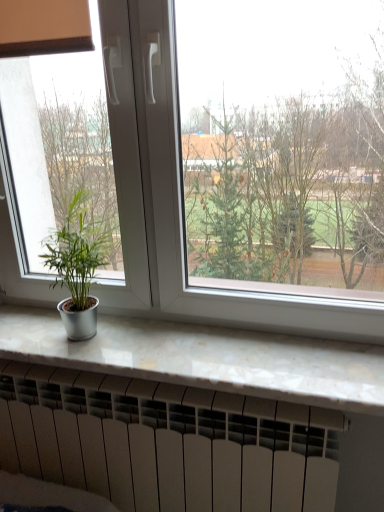
Where is `free point behind green matte plant at left`? free point behind green matte plant at left is located at coordinates (95, 323).